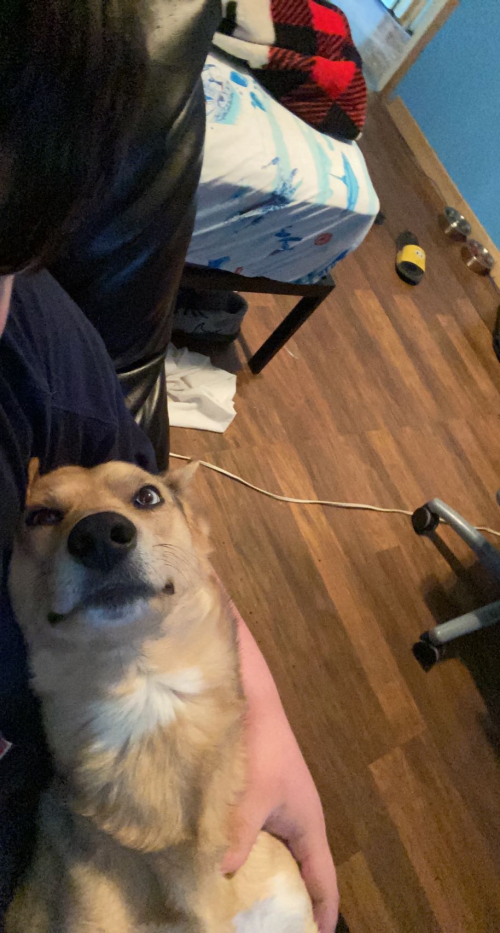
In order to click on legs to office chair in this screenshot , I will do [x=456, y=625], [x=481, y=545].